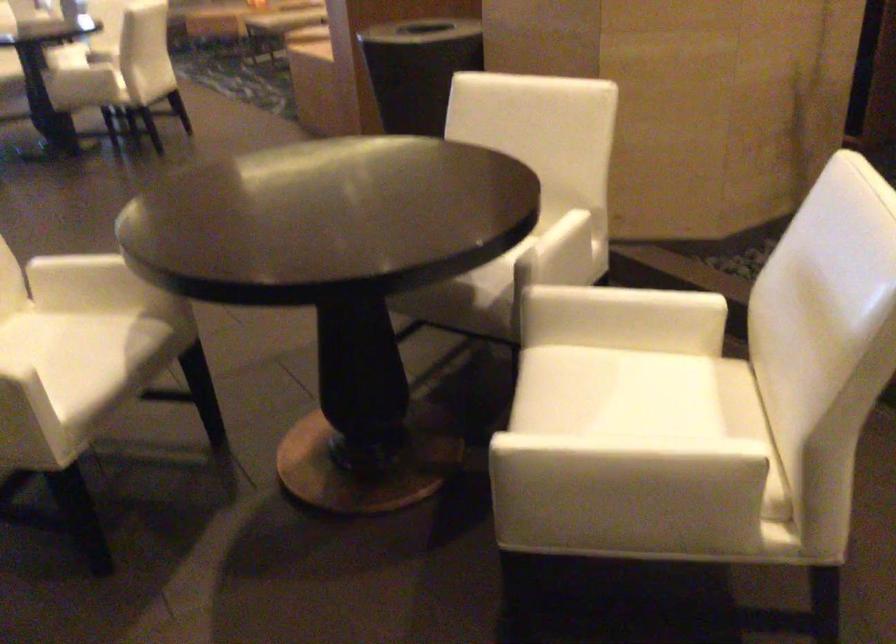
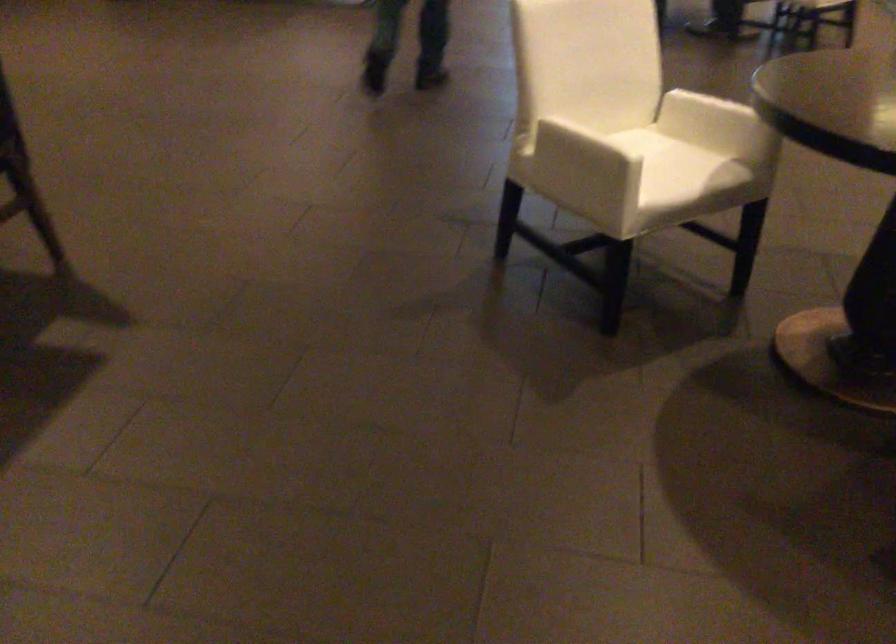
Question: The camera is either moving clockwise (left) or counter-clockwise (right) around the object. The first image is from the beginning of the video and the second image is from the end. Is the camera moving left or right when shooting the video?

Choices:
 (A) Left
 (B) Right

Answer: (B)